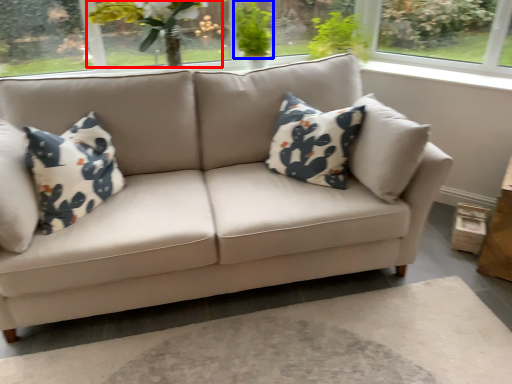
Question: Among these objects, which one is nearest to the camera, floral arrangement (highlighted by a red box) or plant (highlighted by a blue box)?

Choices:
 (A) floral arrangement
 (B) plant

Answer: (A)